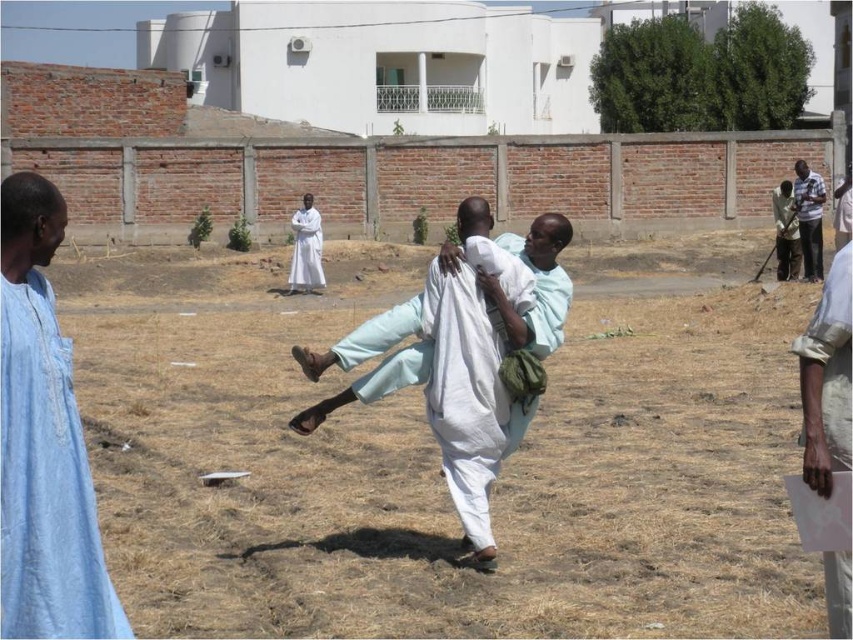
You are a photographer trying to capture a closeup of the white cotton cloth at center. Since the brown dry grass at center is in the way, can you determine if you can move the grass aside to get a clear shot?

The brown dry grass at center has a larger size compared to white cotton cloth at center. Since the grass is larger, it might block the view of the cloth. You can try moving the grass aside to get a clear shot of the white cotton cloth at center.

You are a photographer trying to capture a closeup of the white cotton cloth at center. Given that the brown dry grass at center is in the way, can you determine if the grass is wider than the cloth?

The brown dry grass at center is wider than the white cotton cloth at center, so the grass may block the view of the cloth if positioned in front of it.